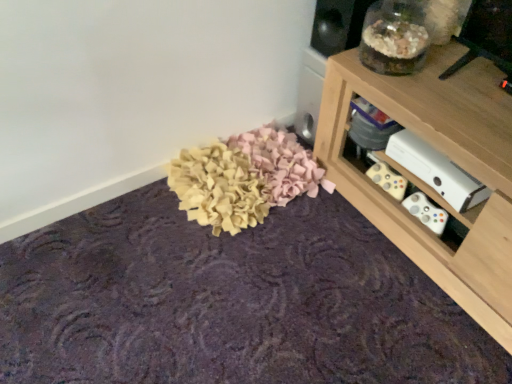
Question: From a real-world perspective, is felt-like fabric at center below wooden shelf at upper right?

Choices:
 (A) no
 (B) yes

Answer: (B)

Question: Does felt-like fabric at center lie behind wooden shelf at upper right?

Choices:
 (A) no
 (B) yes

Answer: (A)

Question: Does felt-like fabric at center have a lesser width compared to wooden shelf at upper right?

Choices:
 (A) yes
 (B) no

Answer: (B)

Question: Is felt-like fabric at center wider than wooden shelf at upper right?

Choices:
 (A) no
 (B) yes

Answer: (B)

Question: Is felt-like fabric at center next to wooden shelf at upper right and touching it?

Choices:
 (A) yes
 (B) no

Answer: (B)

Question: From the image's perspective, is felt-like fabric at center on top of wooden shelf at upper right?

Choices:
 (A) yes
 (B) no

Answer: (B)

Question: Is white matte xbox at lower right looking in the opposite direction of wooden shelf at upper right?

Choices:
 (A) yes
 (B) no

Answer: (A)

Question: Is white matte xbox at lower right bigger than wooden shelf at upper right?

Choices:
 (A) no
 (B) yes

Answer: (A)

Question: Does white matte xbox at lower right have a smaller size compared to wooden shelf at upper right?

Choices:
 (A) no
 (B) yes

Answer: (B)

Question: Is white matte xbox at lower right closer to the viewer compared to wooden shelf at upper right?

Choices:
 (A) no
 (B) yes

Answer: (A)

Question: Can you confirm if white matte xbox at lower right is positioned to the right of wooden shelf at upper right?

Choices:
 (A) no
 (B) yes

Answer: (A)

Question: From the image's perspective, would you say white matte xbox at lower right is shown under wooden shelf at upper right?

Choices:
 (A) yes
 (B) no

Answer: (B)

Question: Can you confirm if white matte xbox at lower right is bigger than felt-like fabric at center?

Choices:
 (A) yes
 (B) no

Answer: (B)